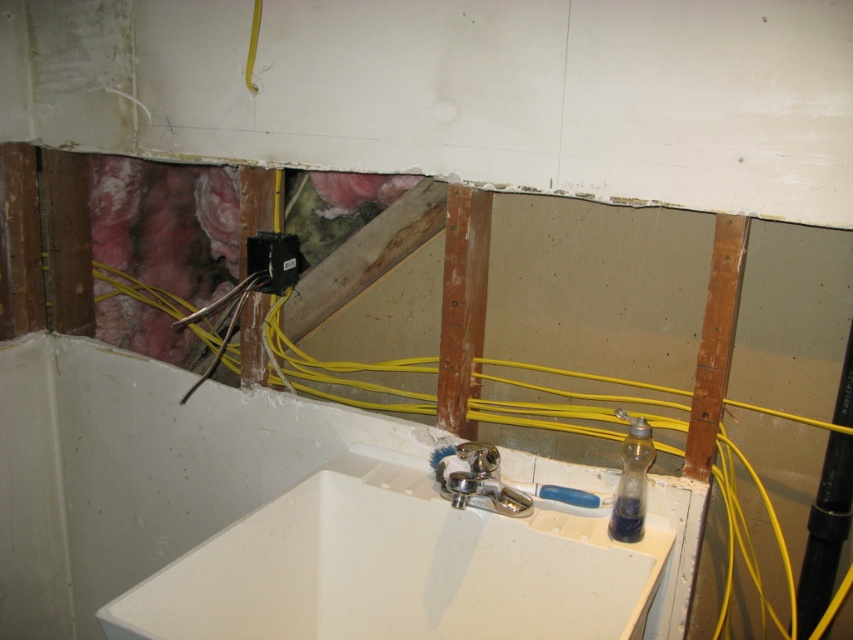
Question: Which of the following is the closest to the observer?

Choices:
 (A) (445, 412)
 (B) (624, 577)

Answer: (B)

Question: Which point is closer to the camera taking this photo?

Choices:
 (A) (149, 403)
 (B) (486, 272)

Answer: (B)

Question: Is white ceramic sink at center further to camera compared to rusty wood beam at center?

Choices:
 (A) no
 (B) yes

Answer: (A)

Question: Which object is closer to the camera taking this photo?

Choices:
 (A) rusty wood beam at center
 (B) white ceramic sink at center

Answer: (B)

Question: Is white ceramic sink at center to the right of rusty wood beam at center from the viewer's perspective?

Choices:
 (A) no
 (B) yes

Answer: (A)

Question: Does white ceramic sink at center come in front of rusty wood beam at center?

Choices:
 (A) no
 (B) yes

Answer: (B)